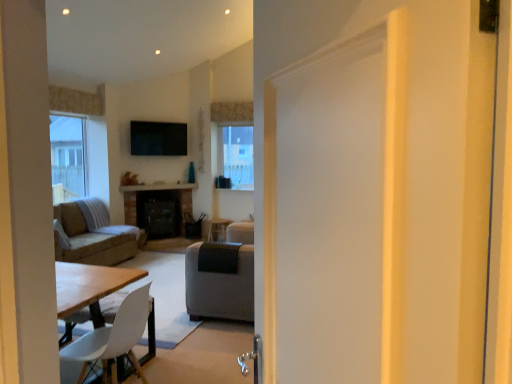
What is the approximate height of soft gray fabric couch at left?

soft gray fabric couch at left is 22.28 inches tall.

The image size is (512, 384). What are the coordinates of `soft gray fabric couch at left` in the screenshot? It's located at (91, 238).

Describe the element at coordinates (91, 238) in the screenshot. The image size is (512, 384). I see `soft gray fabric couch at left` at that location.

Image resolution: width=512 pixels, height=384 pixels. What do you see at coordinates (113, 339) in the screenshot? I see `white matte chair at lower left` at bounding box center [113, 339].

Find the location of a particular element. The height and width of the screenshot is (384, 512). white matte chair at lower left is located at coordinates (113, 339).

The height and width of the screenshot is (384, 512). What are the coordinates of `soft gray fabric couch at left` in the screenshot? It's located at (91, 238).

Considering the relative positions of white matte chair at lower left and soft gray fabric couch at left in the image provided, is white matte chair at lower left to the right of soft gray fabric couch at left from the viewer's perspective?

Indeed, white matte chair at lower left is positioned on the right side of soft gray fabric couch at left.

Does white matte chair at lower left come in front of soft gray fabric couch at left?

Yes, white matte chair at lower left is in front of soft gray fabric couch at left.

Is point (108, 353) closer or farther from the camera than point (67, 253)?

Point (108, 353) is closer to the camera than point (67, 253).

From the image's perspective, which object appears higher, white matte chair at lower left or soft gray fabric couch at left?

soft gray fabric couch at left is shown above in the image.

From a real-world perspective, between white matte chair at lower left and soft gray fabric couch at left, who is vertically lower?

white matte chair at lower left, from a real-world perspective.

In the scene shown: Is white matte chair at lower left thinner than soft gray fabric couch at left?

Indeed, white matte chair at lower left has a lesser width compared to soft gray fabric couch at left.

Between white matte chair at lower left and soft gray fabric couch at left, which one has less height?

soft gray fabric couch at left.

Can you confirm if white matte chair at lower left is bigger than soft gray fabric couch at left?

No.

Is white matte chair at lower left not inside soft gray fabric couch at left?

Yes, white matte chair at lower left is not within soft gray fabric couch at left.

Is white matte chair at lower left not near soft gray fabric couch at left?

Yes, white matte chair at lower left and soft gray fabric couch at left are quite far apart.

Is white matte chair at lower left turned away from soft gray fabric couch at left?

No, white matte chair at lower left is not facing the opposite direction of soft gray fabric couch at left.

How different are the orientations of white matte chair at lower left and soft gray fabric couch at left in degrees?

The angle between the facing direction of white matte chair at lower left and the facing direction of soft gray fabric couch at left is 179 degrees.

Image resolution: width=512 pixels, height=384 pixels. Find the location of `chair lying below the soft gray fabric couch at left (from the image's perspective)`. chair lying below the soft gray fabric couch at left (from the image's perspective) is located at coordinates (113, 339).

Considering the relative positions of soft gray fabric couch at left and white matte chair at lower left in the image provided, is soft gray fabric couch at left to the left of white matte chair at lower left from the viewer's perspective?

Yes, soft gray fabric couch at left is to the left of white matte chair at lower left.

Which object is further away from the camera taking this photo, soft gray fabric couch at left or white matte chair at lower left?

Positioned behind is soft gray fabric couch at left.

Considering the positions of points (67, 226) and (128, 312), is point (67, 226) closer to camera compared to point (128, 312)?

No, (67, 226) is behind (128, 312).

From the image's perspective, is soft gray fabric couch at left beneath white matte chair at lower left?

Actually, soft gray fabric couch at left appears above white matte chair at lower left in the image.

From a real-world perspective, is soft gray fabric couch at left physically above white matte chair at lower left?

Yes, from a real-world perspective, soft gray fabric couch at left is above white matte chair at lower left.

Looking at their sizes, would you say soft gray fabric couch at left is wider or thinner than white matte chair at lower left?

Considering their sizes, soft gray fabric couch at left looks broader than white matte chair at lower left.

Is soft gray fabric couch at left shorter than white matte chair at lower left?

Yes.

Between soft gray fabric couch at left and white matte chair at lower left, which one has larger size?

soft gray fabric couch at left is bigger.

Would you say white matte chair at lower left is part of soft gray fabric couch at left's contents?

No, soft gray fabric couch at left does not contain white matte chair at lower left.

From the picture: Can you see soft gray fabric couch at left touching white matte chair at lower left?

They are not placed beside each other.

Is soft gray fabric couch at left facing away from white matte chair at lower left?

That's not correct — soft gray fabric couch at left is not looking away from white matte chair at lower left.

From the picture: How many degrees apart are the facing directions of soft gray fabric couch at left and white matte chair at lower left?

soft gray fabric couch at left and white matte chair at lower left are facing 179 degrees away from each other.

In the scene shown: How distant is soft gray fabric couch at left from white matte chair at lower left?

A distance of 2.60 meters exists between soft gray fabric couch at left and white matte chair at lower left.

This screenshot has width=512, height=384. I want to click on chair that is on the right side of soft gray fabric couch at left, so click(113, 339).

The height and width of the screenshot is (384, 512). I want to click on chair on the right of soft gray fabric couch at left, so click(x=113, y=339).

What are the coordinates of `studio couch behind the white matte chair at lower left` in the screenshot? It's located at (91, 238).